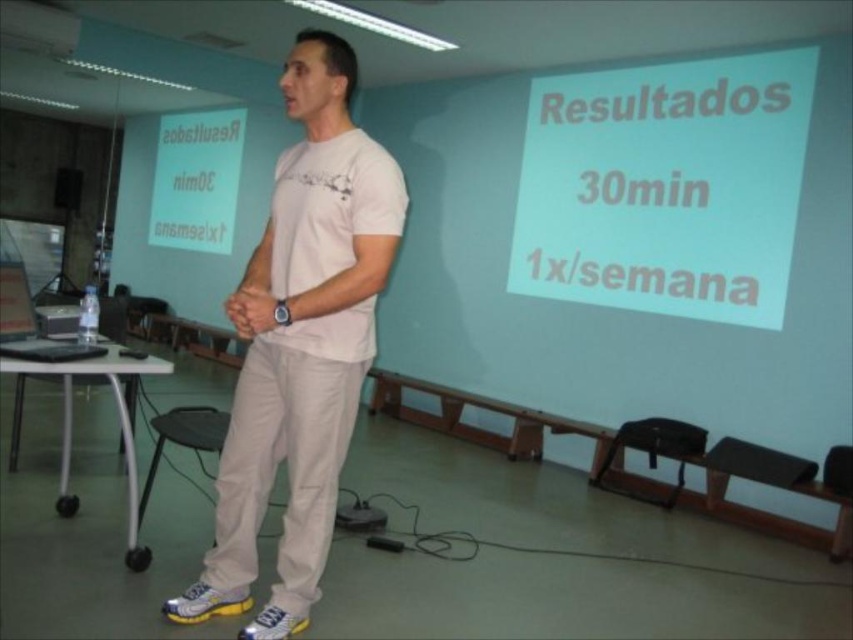
Is point (717, 246) less distant than point (201, 113)?

Yes.

Does white paper at upper center appear over white matte projection screen at upper left?

Incorrect, white paper at upper center is not positioned above white matte projection screen at upper left.

Is point (675, 202) in front of point (199, 220)?

Yes, it is.

The image size is (853, 640). I want to click on white paper at upper center, so click(x=665, y=186).

Does white paper at upper center have a smaller size compared to white cotton t-shirt at center?

No.

Who is positioned more to the right, white paper at upper center or white cotton t-shirt at center?

From the viewer's perspective, white paper at upper center appears more on the right side.

Who is more forward, (730, 106) or (312, 424)?

Point (312, 424) is more forward.

You are a GUI agent. You are given a task and a screenshot of the screen. Output one action in this format:
    pyautogui.click(x=<x>, y=<y>)
    Task: Click on the white paper at upper center
    
    Given the screenshot: What is the action you would take?
    pyautogui.click(x=665, y=186)

Does white matte projection screen at upper left have a smaller size compared to matte skin hands at center?

No.

Can you confirm if white matte projection screen at upper left is positioned above matte skin hands at center?

Yes.

Find the location of a particular element. white matte projection screen at upper left is located at coordinates (196, 179).